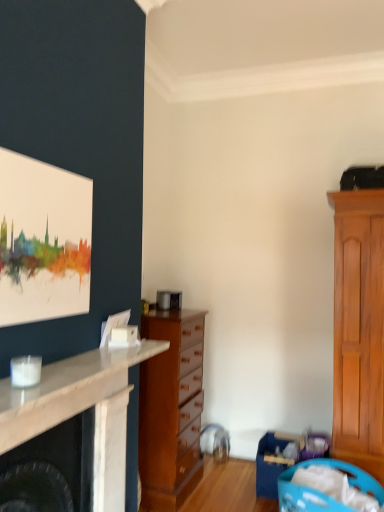
The image size is (384, 512). What are the coordinates of `vacant space situated above white marble fireplace at left (from a real-world perspective)` in the screenshot? It's located at (65, 371).